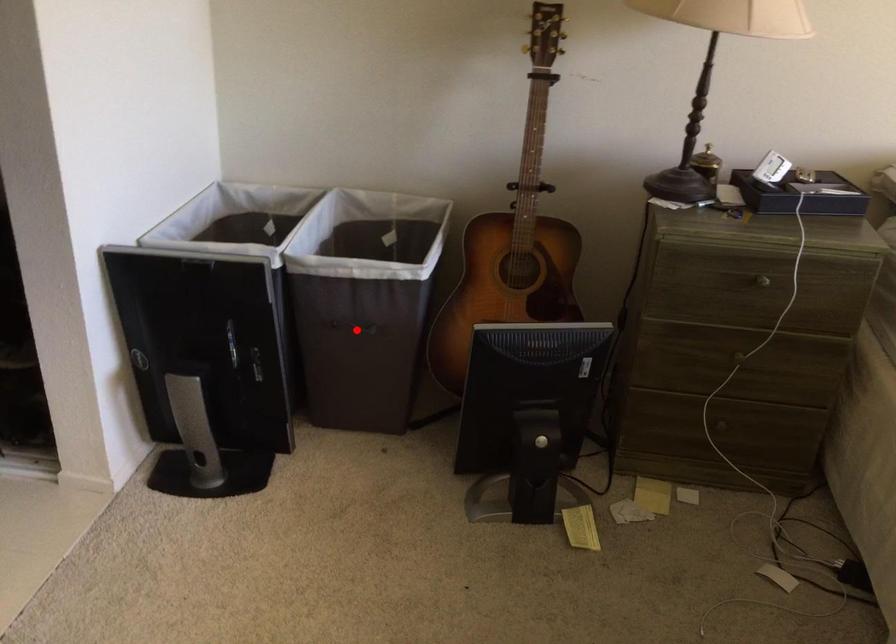
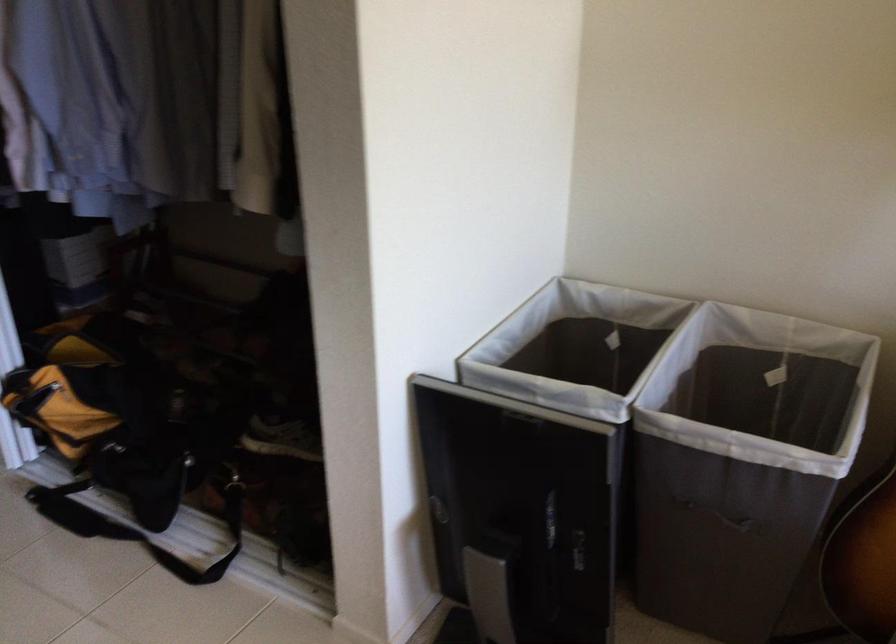
Question: A red point is marked in image1. In image2, is the corresponding 3D point closer to the camera or farther? Reply with the corresponding letter.

Choices:
 (A) The corresponding 3D point is closer.
 (B) The corresponding 3D point is farther.

Answer: (A)